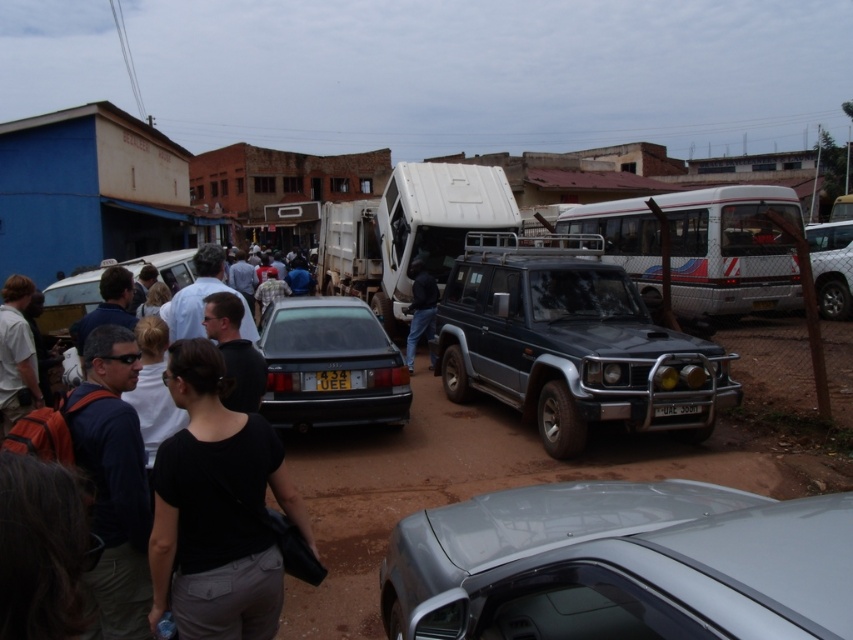
Question: From the image, what is the correct spatial relationship of black fabric crowd at center in relation to yellow matte license plate at center?

Choices:
 (A) below
 (B) above

Answer: (B)

Question: Which point is closer to the camera taking this photo?

Choices:
 (A) (756, 637)
 (B) (30, 348)

Answer: (A)

Question: In this image, where is brown dirt track at center located relative to matte black sedan at center?

Choices:
 (A) left
 (B) right

Answer: (B)

Question: Can you confirm if black fabric crowd at center is wider than matte black sedan at center?

Choices:
 (A) no
 (B) yes

Answer: (A)

Question: Which object is positioned closest to the satin silver car at center?

Choices:
 (A) black plastic license plate at center
 (B) dark blue jeans at center
 (C) black fabric crowd at center

Answer: (C)

Question: Which of the following is the closest to the observer?

Choices:
 (A) metallic blue suv at center
 (B) matte black sedan at center

Answer: (A)